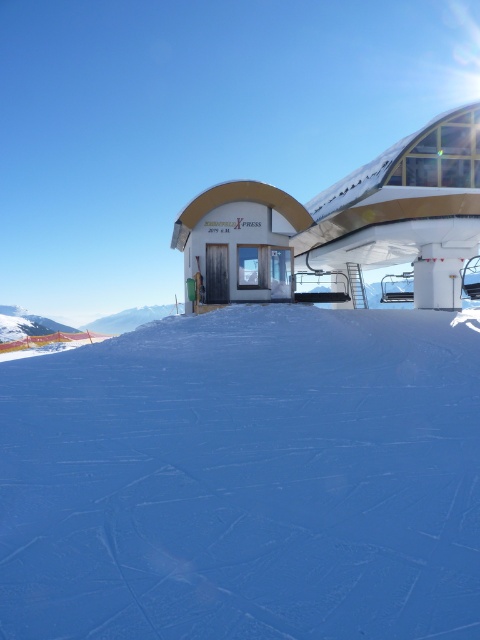
Question: Can you confirm if white smooth snow at center is bigger than white glossy building at center?

Choices:
 (A) no
 (B) yes

Answer: (A)

Question: Is white smooth snow at center bigger than white glossy building at center?

Choices:
 (A) yes
 (B) no

Answer: (B)

Question: Which point appears farthest from the camera in this image?

Choices:
 (A) (415, 253)
 (B) (337, 611)

Answer: (A)

Question: Is white smooth snow at center wider than white glossy building at center?

Choices:
 (A) no
 (B) yes

Answer: (A)

Question: Which point is farther from the camera taking this photo?

Choices:
 (A) (437, 524)
 (B) (201, 289)

Answer: (B)